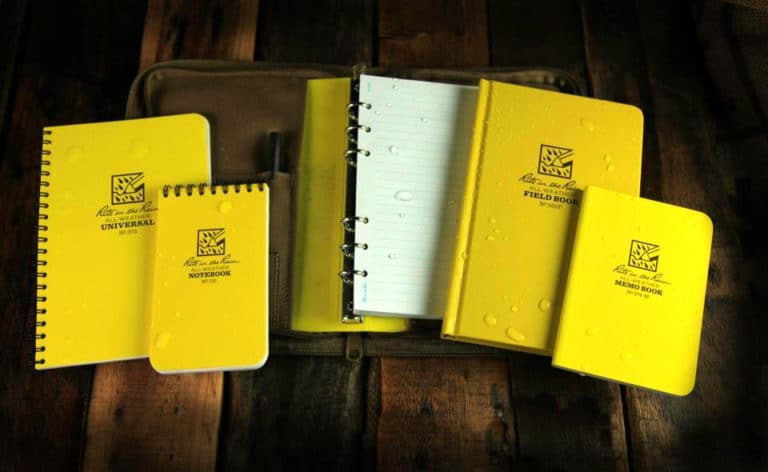
The image size is (768, 472). Find the location of `wooden surface`. wooden surface is located at coordinates (441, 416).